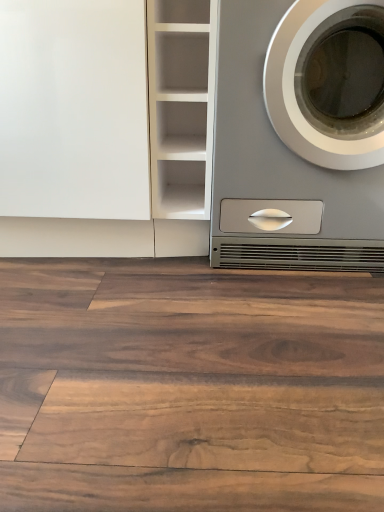
You are a GUI agent. You are given a task and a screenshot of the screen. Output one action in this format:
    pyautogui.click(x=<x>, y=<y>)
    Task: Click on the white glossy cabinet at upper left
    The image size is (384, 512).
    Given the screenshot: What is the action you would take?
    pyautogui.click(x=74, y=110)

The width and height of the screenshot is (384, 512). Find the location of `white matte cabinet at center`. white matte cabinet at center is located at coordinates (181, 105).

You are a GUI agent. You are given a task and a screenshot of the screen. Output one action in this format:
    pyautogui.click(x=<x>, y=<y>)
    Task: Click on the satin silver washing machine at right
    The image size is (384, 512).
    Given the screenshot: What is the action you would take?
    pyautogui.click(x=280, y=170)

You are a GUI agent. You are given a task and a screenshot of the screen. Output one action in this format:
    pyautogui.click(x=<x>, y=<y>)
    Task: Click on the brown wood flooring at center
    
    Given the screenshot: What is the action you would take?
    pyautogui.click(x=189, y=387)

Looking at the image, does brown wood flooring at center seem bigger or smaller compared to white glossy cabinet at upper left?

In the image, brown wood flooring at center appears to be smaller than white glossy cabinet at upper left.

At what (x,y) coordinates should I click in order to perform the action: click on hardwood below the white glossy cabinet at upper left (from the image's perspective). Please return your answer as a coordinate pair (x, y). Looking at the image, I should click on (189, 387).

Which is farther, (36, 259) or (1, 138)?

Point (36, 259)

Can you confirm if brown wood flooring at center is thinner than white glossy cabinet at upper left?

Incorrect, the width of brown wood flooring at center is not less than that of white glossy cabinet at upper left.

From the image's perspective, is white matte cabinet at center located above or below brown wood flooring at center?

From the image's perspective, white matte cabinet at center appears above brown wood flooring at center.

From a real-world perspective, is white matte cabinet at center physically located above or below brown wood flooring at center?

white matte cabinet at center is above brown wood flooring at center.

Looking at this image, can you confirm if white matte cabinet at center is taller than brown wood flooring at center?

Yes, white matte cabinet at center is taller than brown wood flooring at center.

Is white matte cabinet at center wider or thinner than brown wood flooring at center?

Considering their sizes, white matte cabinet at center looks slimmer than brown wood flooring at center.

Is white glossy cabinet at upper left not near brown wood flooring at center?

white glossy cabinet at upper left is near brown wood flooring at center, not far away.

Is white glossy cabinet at upper left not within brown wood flooring at center?

Absolutely, white glossy cabinet at upper left is external to brown wood flooring at center.

Which object is positioned more to the left, white glossy cabinet at upper left or brown wood flooring at center?

From the viewer's perspective, white glossy cabinet at upper left appears more on the left side.

Between satin silver washing machine at right and brown wood flooring at center, which one has more height?

With more height is satin silver washing machine at right.

Could brown wood flooring at center be considered to be inside satin silver washing machine at right?

No, satin silver washing machine at right does not contain brown wood flooring at center.

Does point (260, 236) lie behind point (176, 264)?

That is False.

Is brown wood flooring at center shorter than satin silver washing machine at right?

Correct, brown wood flooring at center is not as tall as satin silver washing machine at right.

Can you tell me how much brown wood flooring at center and satin silver washing machine at right differ in facing direction?

0.562 degrees.

From a real-world perspective, does brown wood flooring at center sit lower than satin silver washing machine at right?

Yes, from a real-world perspective, brown wood flooring at center is below satin silver washing machine at right.

Which of these two, brown wood flooring at center or satin silver washing machine at right, is bigger?

Bigger between the two is satin silver washing machine at right.

In the scene shown: Considering the positions of objects satin silver washing machine at right and white matte cabinet at center in the image provided, who is more to the right, satin silver washing machine at right or white matte cabinet at center?

satin silver washing machine at right.

From a real-world perspective, relative to white matte cabinet at center, is satin silver washing machine at right vertically above or below?

From a real-world perspective, satin silver washing machine at right is physically below white matte cabinet at center.

Which of these two, satin silver washing machine at right or white matte cabinet at center, is wider?

white matte cabinet at center.

Who is shorter, satin silver washing machine at right or white matte cabinet at center?

white matte cabinet at center is shorter.

Can you see white glossy cabinet at upper left touching white matte cabinet at center?

They are not placed beside each other.

Which of these two, white glossy cabinet at upper left or white matte cabinet at center, is wider?

With larger width is white matte cabinet at center.

Does white glossy cabinet at upper left come behind white matte cabinet at center?

Yes, it is behind white matte cabinet at center.

Does white glossy cabinet at upper left have a lesser height compared to white matte cabinet at center?

In fact, white glossy cabinet at upper left may be taller than white matte cabinet at center.

The height and width of the screenshot is (512, 384). Find the location of `hardwood to the right of white glossy cabinet at upper left`. hardwood to the right of white glossy cabinet at upper left is located at coordinates (189, 387).

Identify the location of hardwood on the left of the white matte cabinet at center. (189, 387).

Looking at the image, which one is located further to brown wood flooring at center, white matte cabinet at center or satin silver washing machine at right?

white matte cabinet at center lies further to brown wood flooring at center than the other object.

Based on their spatial positions, is white matte cabinet at center or white glossy cabinet at upper left further from satin silver washing machine at right?

white glossy cabinet at upper left lies further to satin silver washing machine at right than the other object.

Estimate the real-world distances between objects in this image. Which object is further from brown wood flooring at center, satin silver washing machine at right or white glossy cabinet at upper left?

white glossy cabinet at upper left lies further to brown wood flooring at center than the other object.

Which object lies further to the anchor point brown wood flooring at center, white matte cabinet at center or white glossy cabinet at upper left?

Based on the image, white matte cabinet at center appears to be further to brown wood flooring at center.

Considering their positions, is satin silver washing machine at right positioned closer to brown wood flooring at center than white matte cabinet at center?

satin silver washing machine at right is closer to brown wood flooring at center.

In the scene shown: Based on their spatial positions, is satin silver washing machine at right or white glossy cabinet at upper left closer to white matte cabinet at center?

white glossy cabinet at upper left.

Estimate the real-world distances between objects in this image. Which object is closer to white glossy cabinet at upper left, brown wood flooring at center or white matte cabinet at center?

Among the two, white matte cabinet at center is located nearer to white glossy cabinet at upper left.

Considering their positions, is satin silver washing machine at right positioned closer to white glossy cabinet at upper left than white matte cabinet at center?

white matte cabinet at center lies closer to white glossy cabinet at upper left than the other object.

Find the location of a particular element. washing machine between white matte cabinet at center and brown wood flooring at center in the vertical direction is located at coordinates (280, 170).

I want to click on cabinet situated between white glossy cabinet at upper left and satin silver washing machine at right from left to right, so click(181, 105).

You are a GUI agent. You are given a task and a screenshot of the screen. Output one action in this format:
    pyautogui.click(x=<x>, y=<y>)
    Task: Click on the glass door that lies between white matte cabinet at center and brown wood flooring at center from top to bottom
    This screenshot has width=384, height=512.
    Given the screenshot: What is the action you would take?
    pyautogui.click(x=74, y=110)

Locate an element on the screen. The image size is (384, 512). hardwood situated between white glossy cabinet at upper left and satin silver washing machine at right from left to right is located at coordinates (189, 387).